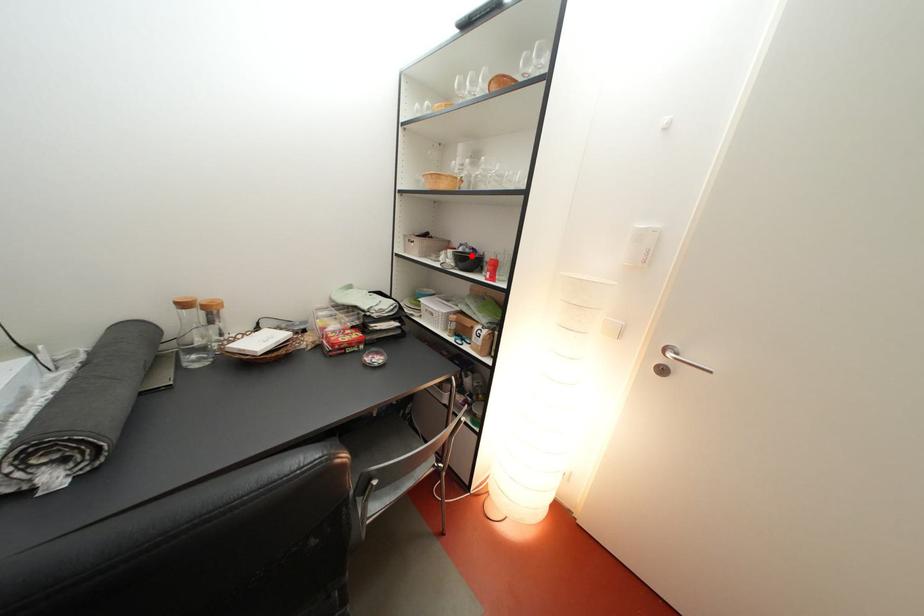
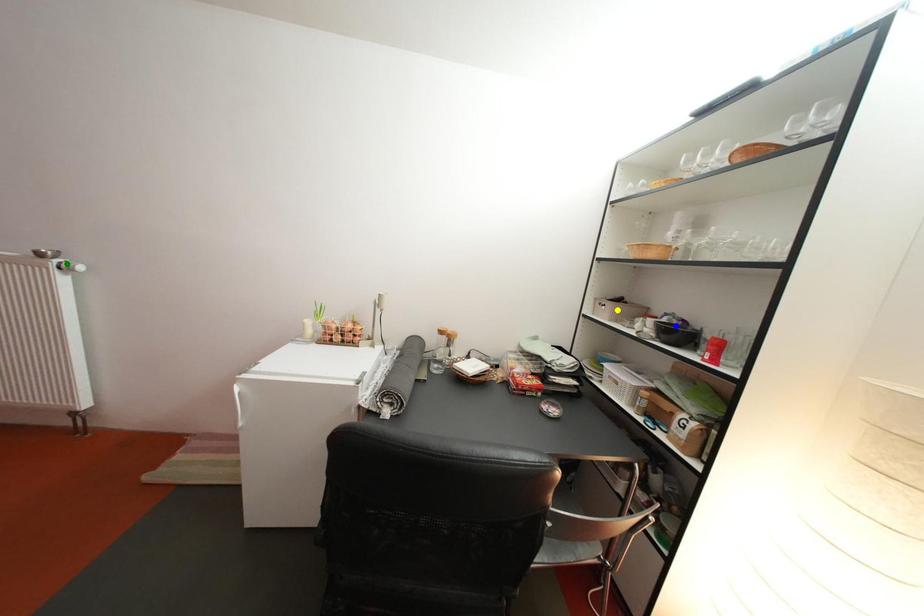
Question: I am providing you with two images of the same scene from different viewpoints. A red point is marked on the first image. You are given multiple points on the second image. Which mark in image 2 goes with the point in image 1?

Choices:
 (A) yellow point
 (B) blue point
 (C) green point

Answer: (B)